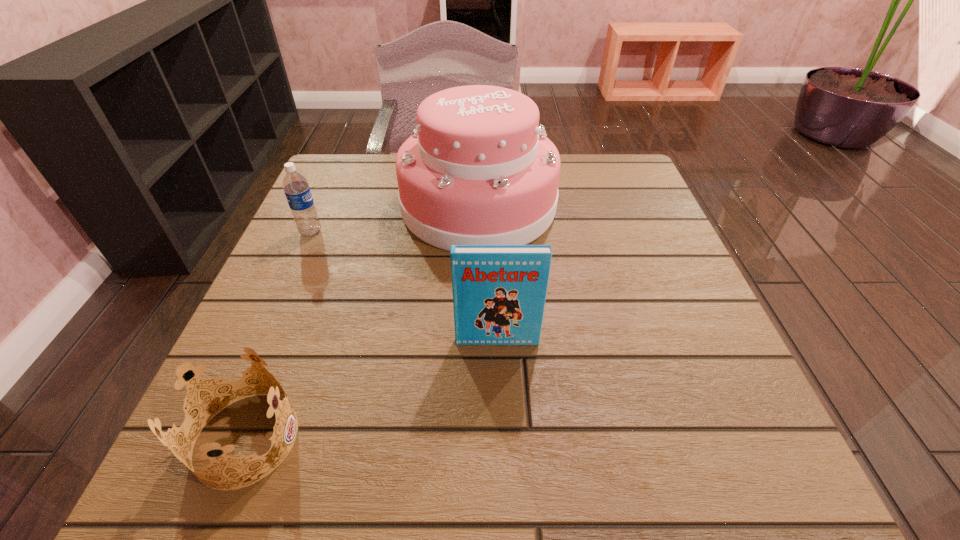
Image resolution: width=960 pixels, height=540 pixels. I want to click on cake, so click(x=478, y=170).

Locate an element on the screen. Image resolution: width=960 pixels, height=540 pixels. book is located at coordinates (499, 291).

Where is `the second nearest object`? the second nearest object is located at coordinates [499, 291].

Find the location of a particular element. Image resolution: width=960 pixels, height=540 pixels. water bottle is located at coordinates (296, 188).

Find the location of a particular element. The height and width of the screenshot is (540, 960). crown is located at coordinates (184, 402).

The width and height of the screenshot is (960, 540). In order to click on the shortest object in this screenshot , I will do `click(184, 402)`.

Where is `free space located on the right of the cake`? Image resolution: width=960 pixels, height=540 pixels. free space located on the right of the cake is located at coordinates (578, 205).

What are the coordinates of `free region located on the front cover of the second tallest object` in the screenshot? It's located at (501, 453).

This screenshot has width=960, height=540. I want to click on vacant space positioned 0.150m on the front of the third tallest object, so click(285, 291).

Locate an element on the screen. vacant region located 0.280m on the back of the nearest object is located at coordinates (315, 267).